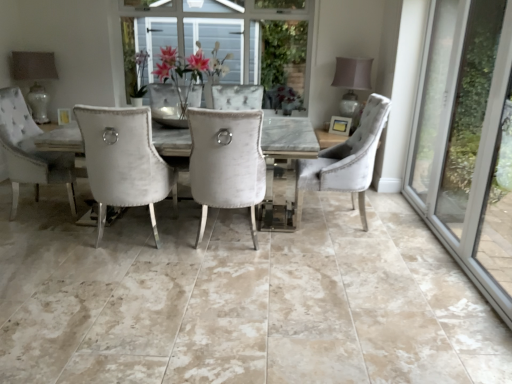
Question: From a real-world perspective, is matte gray lampshade at upper right, arranged as the 2th lamp when viewed from the left, located higher than matte glass lampshade at upper left, arranged as the 1th lamp when viewed from the left?

Choices:
 (A) no
 (B) yes

Answer: (B)

Question: From the image's perspective, is matte gray lampshade at upper right, arranged as the 2th lamp when viewed from the left, above matte glass lampshade at upper left, arranged as the 1th lamp when viewed from the left?

Choices:
 (A) yes
 (B) no

Answer: (B)

Question: Does matte gray lampshade at upper right, arranged as the 2th lamp when viewed from the left, appear on the right side of matte glass lampshade at upper left, arranged as the 1th lamp when viewed from the left?

Choices:
 (A) yes
 (B) no

Answer: (A)

Question: Considering the relative sizes of matte gray lampshade at upper right, arranged as the 2th lamp when viewed from the left, and matte glass lampshade at upper left, arranged as the 1th lamp when viewed from the left, in the image provided, is matte gray lampshade at upper right, arranged as the 2th lamp when viewed from the left, bigger than matte glass lampshade at upper left, arranged as the 1th lamp when viewed from the left,?

Choices:
 (A) yes
 (B) no

Answer: (A)

Question: Considering the relative sizes of matte gray lampshade at upper right, arranged as the 2th lamp when viewed from the left, and matte glass lampshade at upper left, arranged as the 1th lamp when viewed from the left, in the image provided, is matte gray lampshade at upper right, arranged as the 2th lamp when viewed from the left, wider than matte glass lampshade at upper left, arranged as the 1th lamp when viewed from the left,?

Choices:
 (A) yes
 (B) no

Answer: (A)

Question: Considering the relative sizes of matte gray lampshade at upper right, arranged as the 2th lamp when viewed from the left, and matte glass lampshade at upper left, arranged as the 1th lamp when viewed from the left, in the image provided, is matte gray lampshade at upper right, arranged as the 2th lamp when viewed from the left, shorter than matte glass lampshade at upper left, arranged as the 1th lamp when viewed from the left,?

Choices:
 (A) no
 (B) yes

Answer: (B)

Question: Can you confirm if matte gray lampshade at upper right, arranged as the 2th lamp when viewed from the left, is thinner than velvet grey chair at right, the second chair in the left-to-right sequence?

Choices:
 (A) yes
 (B) no

Answer: (A)

Question: Does matte gray lampshade at upper right, arranged as the 2th lamp when viewed from the left, have a lesser height compared to velvet grey chair at right, which ranks as the first chair in right-to-left order?

Choices:
 (A) yes
 (B) no

Answer: (A)

Question: Is the depth of matte gray lampshade at upper right, the first lamp from the right, less than that of velvet grey chair at right, which ranks as the first chair in right-to-left order?

Choices:
 (A) yes
 (B) no

Answer: (B)

Question: Is matte gray lampshade at upper right, arranged as the 2th lamp when viewed from the left, facing towards velvet grey chair at right, which ranks as the first chair in right-to-left order?

Choices:
 (A) no
 (B) yes

Answer: (B)

Question: Would you say velvet grey chair at right, which ranks as the first chair in right-to-left order, is part of matte gray lampshade at upper right, the first lamp from the right,'s contents?

Choices:
 (A) no
 (B) yes

Answer: (A)

Question: Are matte gray lampshade at upper right, the first lamp from the right, and velvet grey chair at right, the second chair in the left-to-right sequence, making contact?

Choices:
 (A) no
 (B) yes

Answer: (A)

Question: Could you tell me if matte glass lampshade at upper left, arranged as the 1th lamp when viewed from the left, is facing velvet white chair at center, which ranks as the first chair in left-to-right order?

Choices:
 (A) no
 (B) yes

Answer: (A)